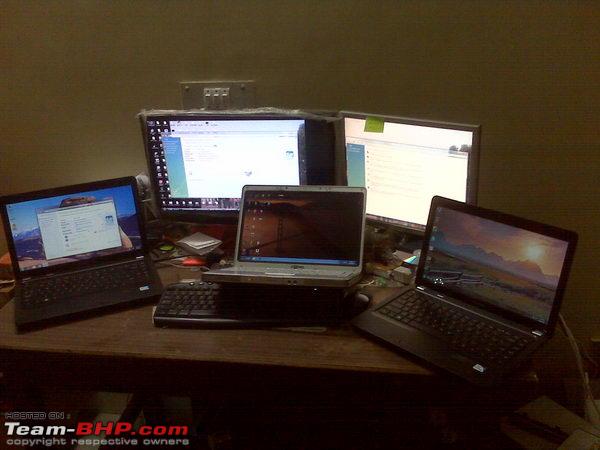
Locate an element on the screen. This screenshot has height=450, width=600. monitor on left is located at coordinates (227, 146).